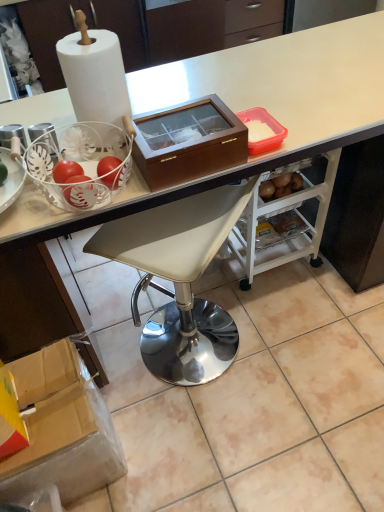
In order to click on free location to the right of white leather stool at center in this screenshot , I will do `click(291, 346)`.